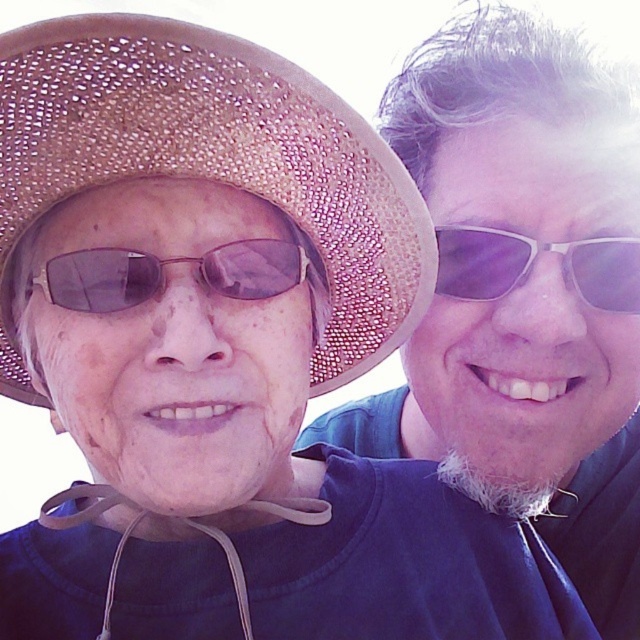
Is strawhat at center positioned in front of sunglasses at center?

Yes.

Who is more forward, (186, 83) or (284, 285)?

Point (186, 83)

Which is behind, point (364, 344) or point (280, 243)?

The point (364, 344) is more distant.

In order to click on strawhat at center in this screenshot , I will do `click(218, 156)`.

From the picture: Can you confirm if matte black shirt at upper right is taller than sunglassestransparentglasses at right?

Indeed, matte black shirt at upper right has a greater height compared to sunglassestransparentglasses at right.

Describe the element at coordinates (524, 289) in the screenshot. The height and width of the screenshot is (640, 640). I see `matte black shirt at upper right` at that location.

Locate an element on the screen. This screenshot has width=640, height=640. matte black shirt at upper right is located at coordinates (524, 289).

Is matte black shirt at upper right smaller than strawhat at center?

Yes.

Consider the image. Which is below, matte black shirt at upper right or strawhat at center?

strawhat at center is lower down.

Who is more forward, (540, 522) or (74, 26)?

Point (74, 26) is in front.

Identify the location of matte black shirt at upper right. This screenshot has width=640, height=640. (524, 289).